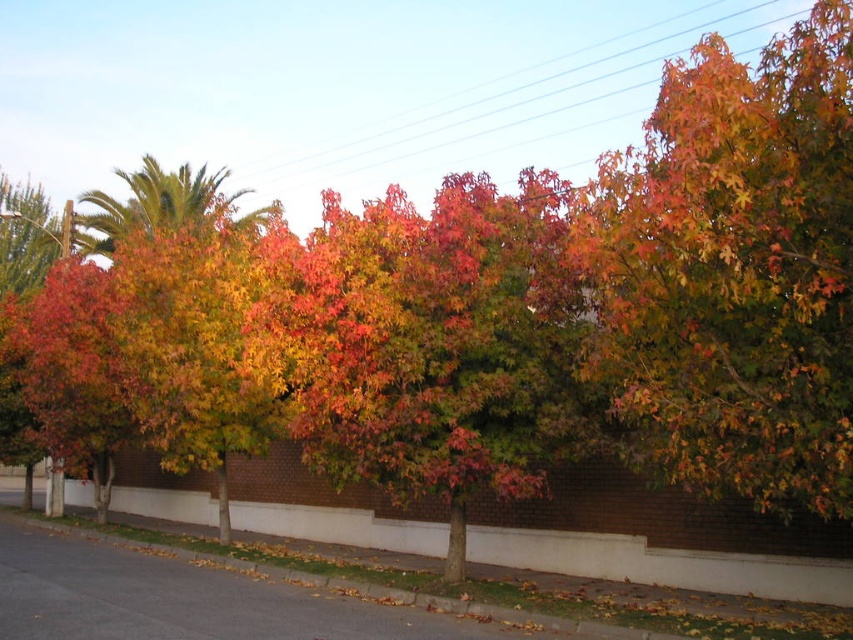
You are a pedestrian walking on the sidewalk and want to take a photo of both the multicolored foliage at upper right and the shiny red leaves at center. Which object should you position closer to the camera to ensure both fit in the frame?

Since the multicolored foliage at upper right is wider than the shiny red leaves at center, you should position the multicolored foliage at upper right closer to the camera to ensure both fit in the frame.